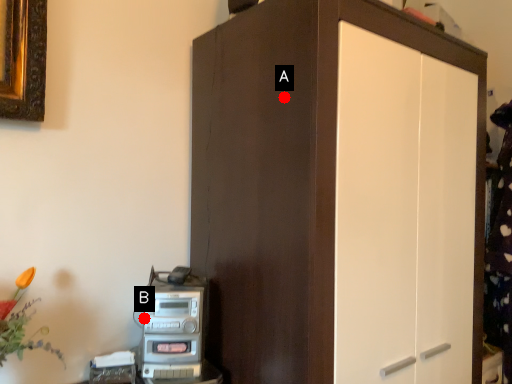
Question: Two points are circled on the image, labeled by A and B beside each circle. Which point is farther to the camera?

Choices:
 (A) A is further
 (B) B is further

Answer: (B)